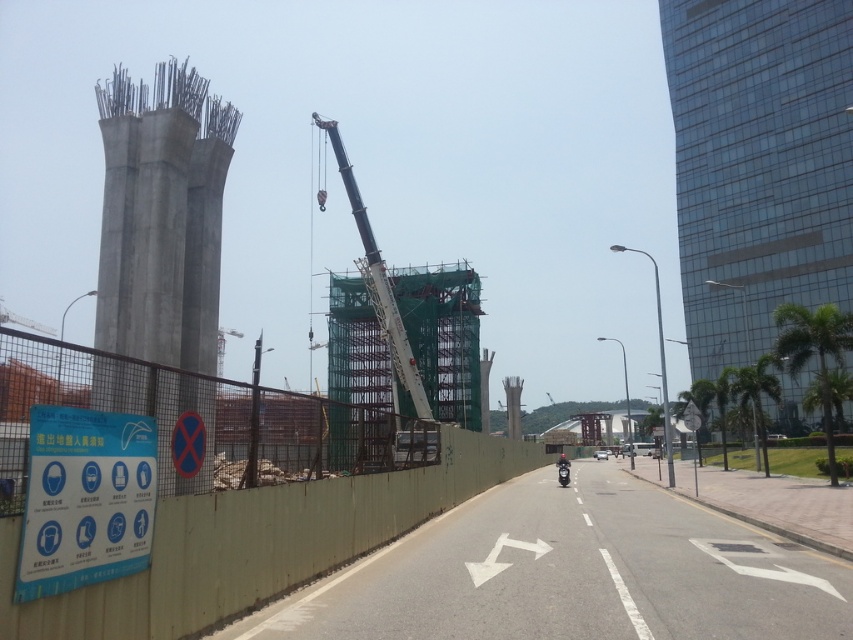
Does green concrete fence at left appear under blue paper sign at lower left?

Yes, green concrete fence at left is below blue paper sign at lower left.

Does green concrete fence at left have a greater width compared to blue paper sign at lower left?

Yes, green concrete fence at left is wider than blue paper sign at lower left.

Measure the distance between green concrete fence at left and camera.

green concrete fence at left is 4.38 meters from camera.

Where is `green concrete fence at left`? The height and width of the screenshot is (640, 853). green concrete fence at left is located at coordinates click(224, 488).

Which is above, green concrete fence at left or concrete pillar at left?

Positioned higher is concrete pillar at left.

Does green concrete fence at left have a lesser height compared to concrete pillar at left?

Yes, green concrete fence at left is shorter than concrete pillar at left.

Who is more distant from viewer, (160, 605) or (107, 205)?

The point (107, 205) is behind.

You are a GUI agent. You are given a task and a screenshot of the screen. Output one action in this format:
    pyautogui.click(x=<x>, y=<y>)
    Task: Click on the green concrete fence at left
    The image size is (853, 640).
    Given the screenshot: What is the action you would take?
    pyautogui.click(x=224, y=488)

Based on the photo, between green concrete fence at left and shiny black motorcycle at center, which one appears on the right side from the viewer's perspective?

Positioned to the right is shiny black motorcycle at center.

Image resolution: width=853 pixels, height=640 pixels. What do you see at coordinates (224, 488) in the screenshot? I see `green concrete fence at left` at bounding box center [224, 488].

This screenshot has width=853, height=640. What are the coordinates of `green concrete fence at left` in the screenshot? It's located at (224, 488).